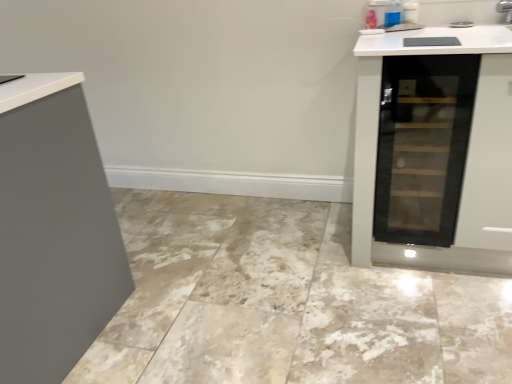
Question: From a real-world perspective, relative to transparent glass wine cooler at right, is marble tile at center vertically above or below?

Choices:
 (A) below
 (B) above

Answer: (A)

Question: Considering the positions of point (457, 286) and point (463, 114), is point (457, 286) closer or farther from the camera than point (463, 114)?

Choices:
 (A) farther
 (B) closer

Answer: (A)

Question: Based on their sizes in the image, would you say marble tile at center is bigger or smaller than transparent glass wine cooler at right?

Choices:
 (A) small
 (B) big

Answer: (B)

Question: Is transparent glass wine cooler at right to the left or to the right of marble tile at center in the image?

Choices:
 (A) right
 (B) left

Answer: (A)

Question: Based on their sizes in the image, would you say transparent glass wine cooler at right is bigger or smaller than marble tile at center?

Choices:
 (A) big
 (B) small

Answer: (B)

Question: From a real-world perspective, relative to marble tile at center, is transparent glass wine cooler at right vertically above or below?

Choices:
 (A) above
 (B) below

Answer: (A)

Question: From the image's perspective, is transparent glass wine cooler at right above or below marble tile at center?

Choices:
 (A) below
 (B) above

Answer: (B)